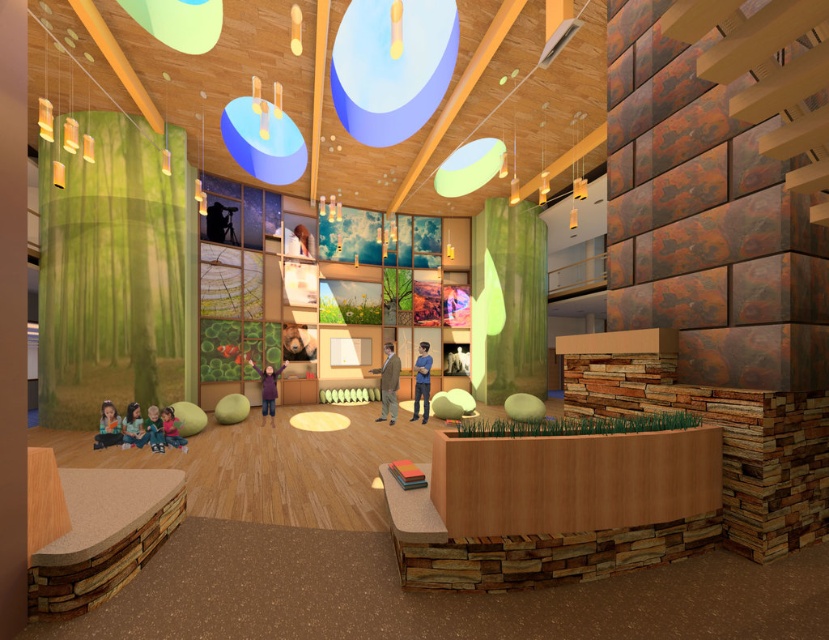
You are a visitor in this childrens space and want to know which object is wider between the green matte curtain at left and the green glass leaf at center. Can you tell me?

The green matte curtain at left is wider than the green glass leaf at center.

You are standing in the middle of the room and looking at two points marked in the image. The first point is at coordinates point (139, 369) and the second point is at point (488, 333). Which of these points is closer to your current position?

Point (139, 369) is closer to the camera than point (488, 333), so the first point is closer to your current position.